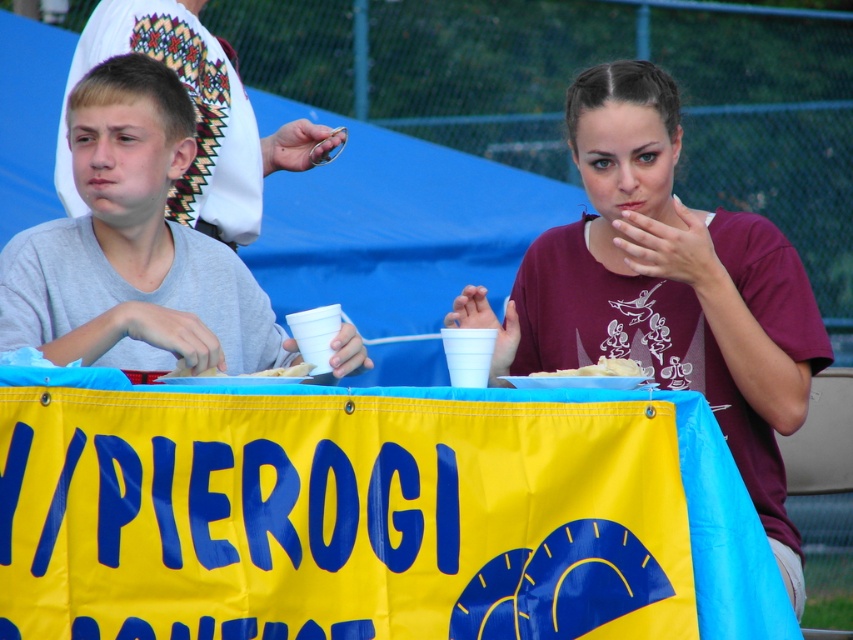
Question: In this image, where is yellow fabric banner at center located relative to gray matte shirt at left?

Choices:
 (A) above
 (B) below

Answer: (B)

Question: Which point is farther to the camera?

Choices:
 (A) (177, 371)
 (B) (780, 314)

Answer: (B)

Question: Is yellow fabric banner at center behind gray matte shirt at left?

Choices:
 (A) no
 (B) yes

Answer: (A)

Question: Which of these objects is positioned closest to the gray matte shirt at left?

Choices:
 (A) white matte food at center
 (B) maroon t-shirt at center
 (C) white dough at center
 (D) yellow fabric banner at center

Answer: (C)

Question: Is gray matte shirt at left positioned in front of white dough at center?

Choices:
 (A) no
 (B) yes

Answer: (A)

Question: Considering the real-world distances, which object is closest to the white dough at center?

Choices:
 (A) white matte food at center
 (B) yellow fabric banner at center
 (C) maroon t-shirt at center

Answer: (B)